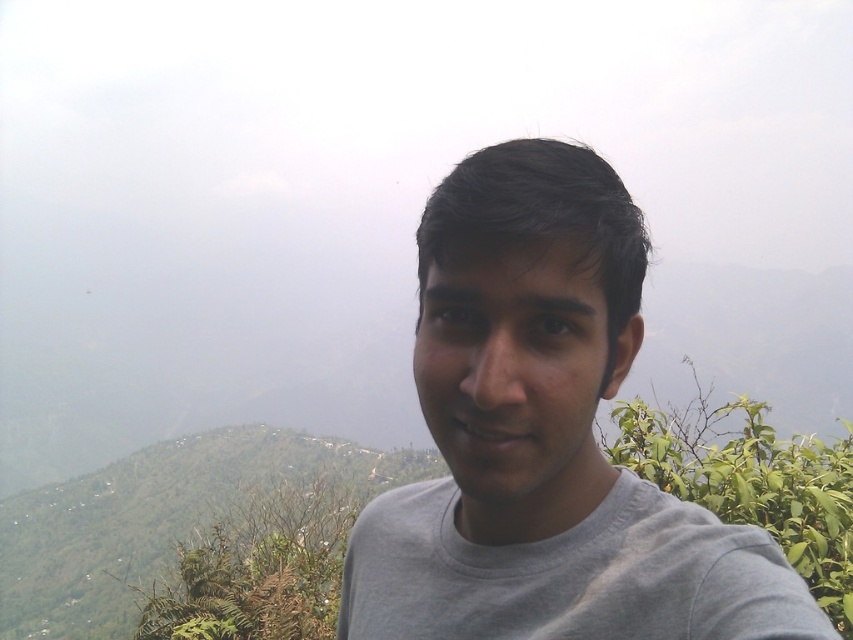
Question: Is gray cotton shirt at center to the left of gray cotton t-shirt at center from the viewer's perspective?

Choices:
 (A) yes
 (B) no

Answer: (A)

Question: Among these objects, which one is nearest to the camera?

Choices:
 (A) gray cotton shirt at center
 (B) green leafy bush at right
 (C) gray cotton t-shirt at center

Answer: (C)

Question: Is gray cotton shirt at center wider than gray cotton t-shirt at center?

Choices:
 (A) no
 (B) yes

Answer: (B)

Question: Which point is closer to the camera?

Choices:
 (A) (566, 545)
 (B) (815, 440)
 (C) (636, 312)

Answer: (C)

Question: Which of the following is the closest to the observer?

Choices:
 (A) (672, 536)
 (B) (448, 634)
 (C) (757, 493)

Answer: (A)

Question: Does gray cotton shirt at center lie in front of gray cotton t-shirt at center?

Choices:
 (A) yes
 (B) no

Answer: (B)